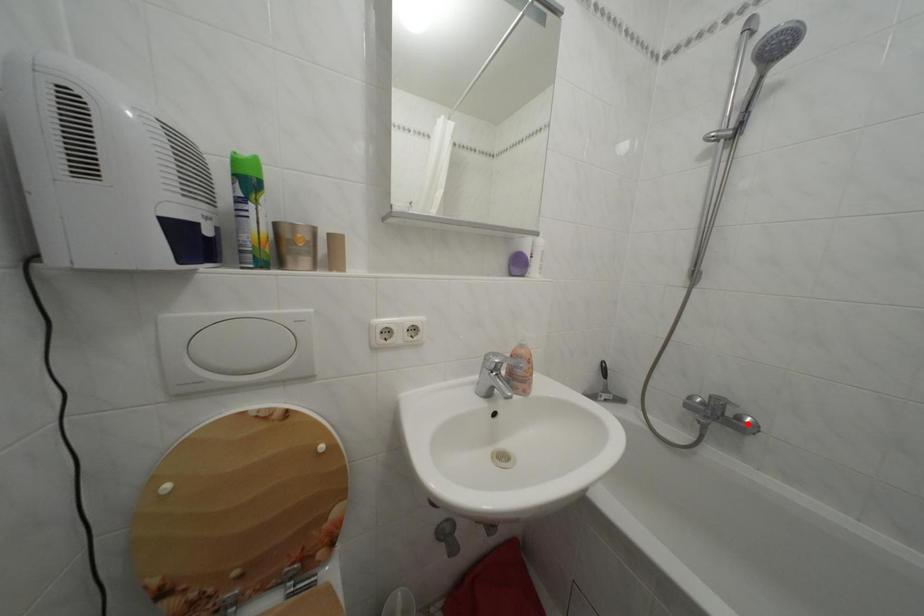
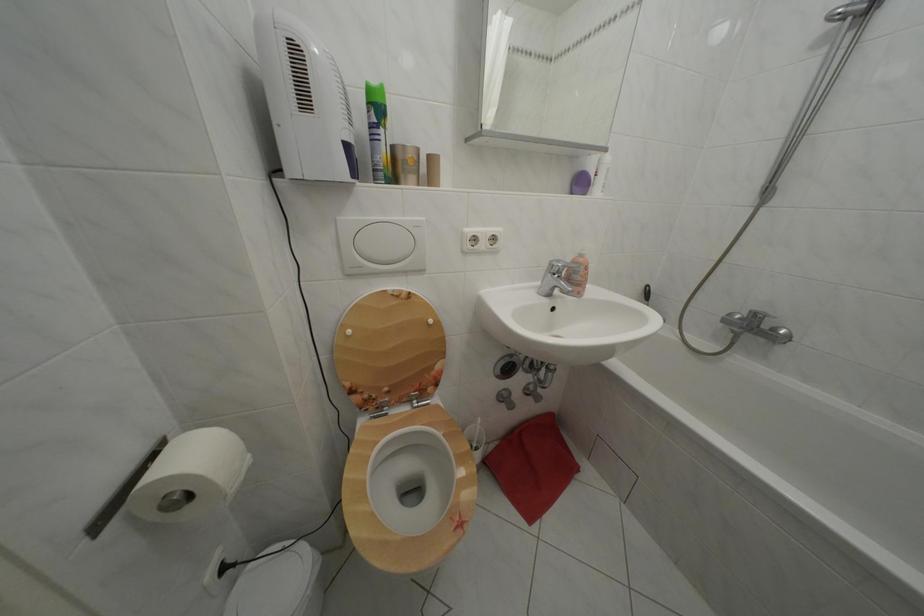
Where in the second image is the point corresponding to the highlighted location from the first image?

(783, 336)